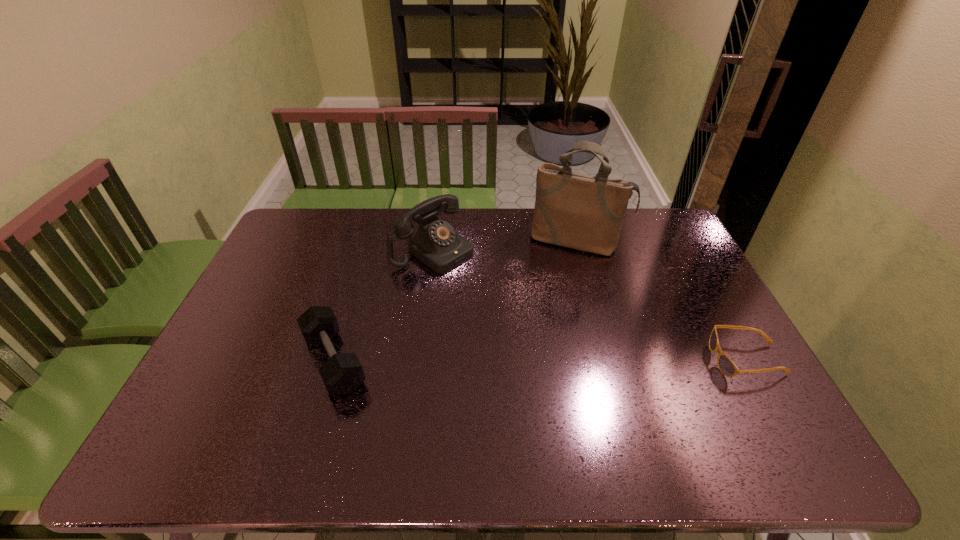
The image size is (960, 540). I want to click on vacant spot on the desktop that is between the dumbbell and the sunglasses and is positioned on the front-facing side of the shoulder bag, so click(x=543, y=360).

Find the location of a particular element. The height and width of the screenshot is (540, 960). free space on the desktop that is between the third tallest object and the sunglasses and is positioned on the dial of the telephone is located at coordinates (587, 360).